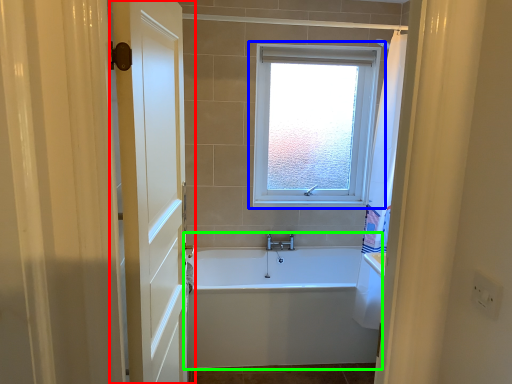
Question: Which object is positioned farthest from door (highlighted by a red box)? Select from window (highlighted by a blue box) and bathtub (highlighted by a green box).

Choices:
 (A) window
 (B) bathtub

Answer: (A)